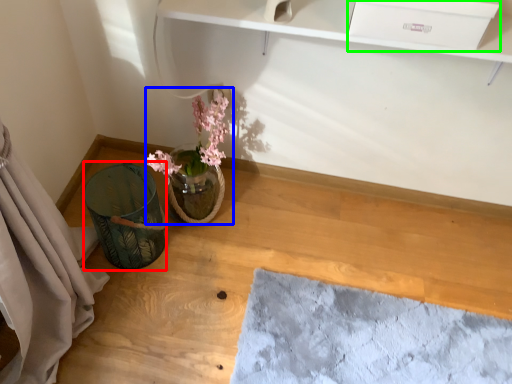
Question: Estimate the real-world distances between objects in this image. Which object is closer to vase (highlighted by a red box), floral arrangement (highlighted by a blue box) or drawer (highlighted by a green box)?

Choices:
 (A) floral arrangement
 (B) drawer

Answer: (A)